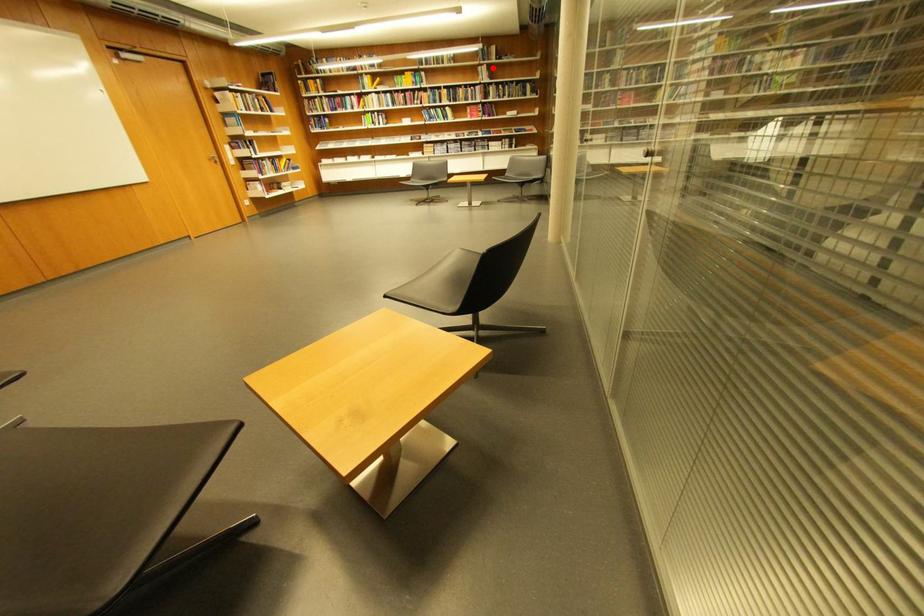
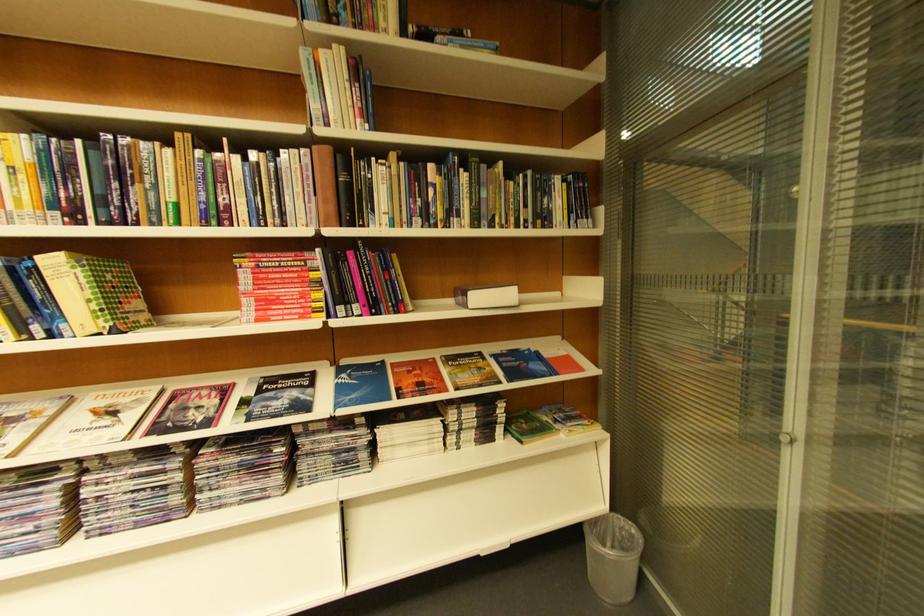
Locate, in the second image, the point that corresponds to the highlighted location in the first image.

(332, 55)